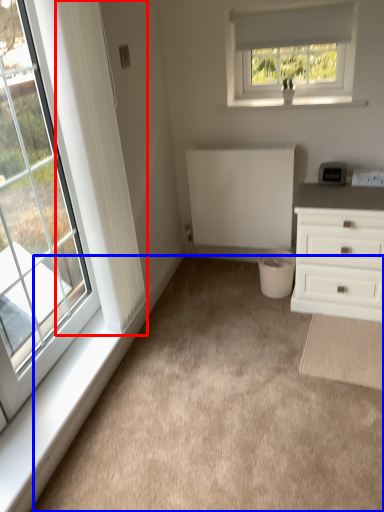
Question: Which of the following is the farthest to the observer, curtain (highlighted by a red box) or plain (highlighted by a blue box)?

Choices:
 (A) curtain
 (B) plain

Answer: (A)